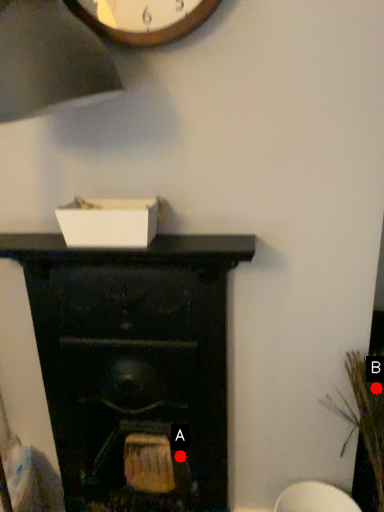
Question: Two points are circled on the image, labeled by A and B beside each circle. Which point appears farthest from the camera in this image?

Choices:
 (A) A is further
 (B) B is further

Answer: (A)